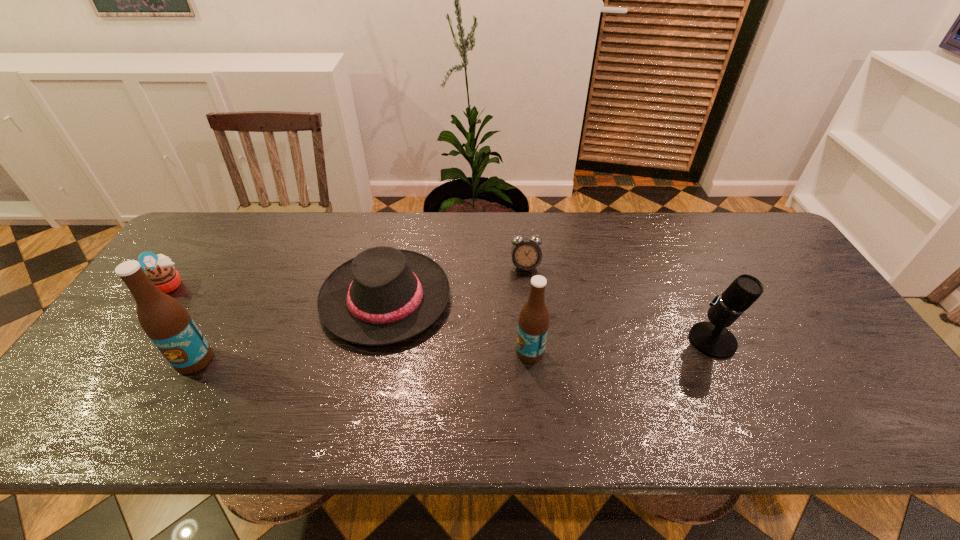
The image size is (960, 540). Find the location of `free space located 0.150m on the left of the third object from left to right`. free space located 0.150m on the left of the third object from left to right is located at coordinates (268, 299).

Identify the location of vacant space situated on the right of the fourth shortest object. This screenshot has height=540, width=960. (770, 341).

Where is `free space located 0.290m on the face of the alarm clock`? This screenshot has height=540, width=960. free space located 0.290m on the face of the alarm clock is located at coordinates (535, 356).

Find the location of a particular element. The height and width of the screenshot is (540, 960). blank space located on the front-facing side of the muffin is located at coordinates tap(311, 284).

Locate an element on the screen. The image size is (960, 540). dress hat positioned at the far edge is located at coordinates (384, 295).

Where is `alarm clock present at the far edge`? Image resolution: width=960 pixels, height=540 pixels. alarm clock present at the far edge is located at coordinates (526, 255).

This screenshot has width=960, height=540. What are the coordinates of `object located in the near edge section of the desktop` in the screenshot? It's located at (166, 322).

This screenshot has height=540, width=960. In order to click on object positioned at the left edge in this screenshot , I will do `click(160, 270)`.

The height and width of the screenshot is (540, 960). Identify the location of blank space at the far edge. (711, 226).

Where is `free space at the near edge of the desktop`? The width and height of the screenshot is (960, 540). free space at the near edge of the desktop is located at coordinates (251, 370).